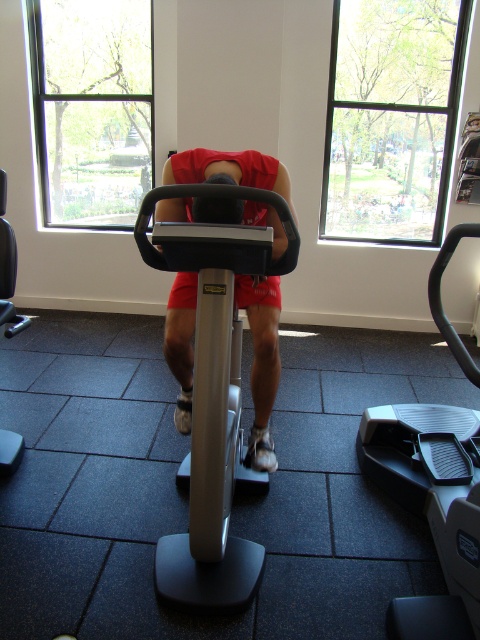
You are a photographer positioned at the front of the gym. You want to take a photo of the stationary bike and ensure both the point at coordinates point (x=459, y=445) and point (x=189, y=205) are clearly visible in the frame. Which point should you focus on first to ensure both are in focus?

You should focus on point (x=189, y=205) first because it is closer to the camera than point (x=459, y=445). By focusing on the closer point, the depth of field may also keep the farther point in focus.